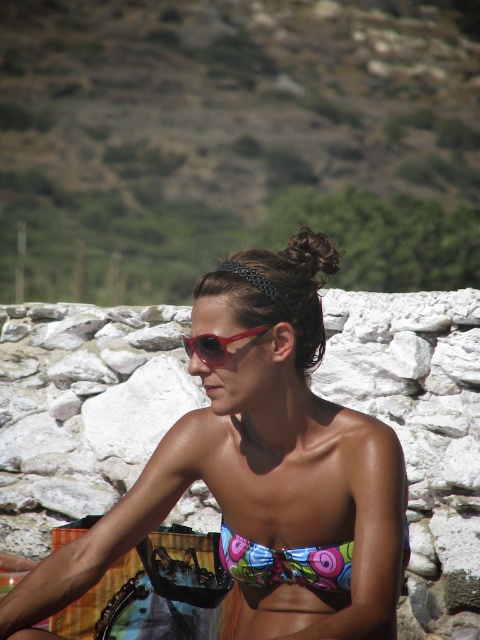
You are standing at the origin of a coordinate system placed at the bottom left corner of the image. You see two points, point [265,552] and point [239,337]. Which point is farther from the origin?

Point [265,552] is farther from the origin because it has a greater distance in both the x and y coordinates compared to point [239,337].

You are a photographer trying to capture the perfect shot of the matte pink sunglasses at center and the multicolored fabric bikini at center. From the perspective of the camera lens, which object is located to the left?

The matte pink sunglasses at center is positioned on the left side of the multicolored fabric bikini at center, so from the camera lens perspective, the matte pink sunglasses at center is on the left.